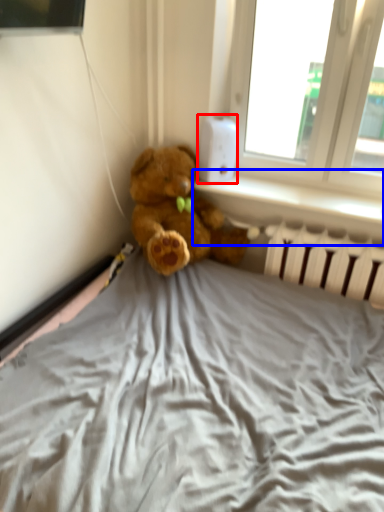
Question: Which of the following is the farthest to the observer, thermostat (highlighted by a red box) or window sill (highlighted by a blue box)?

Choices:
 (A) thermostat
 (B) window sill

Answer: (A)